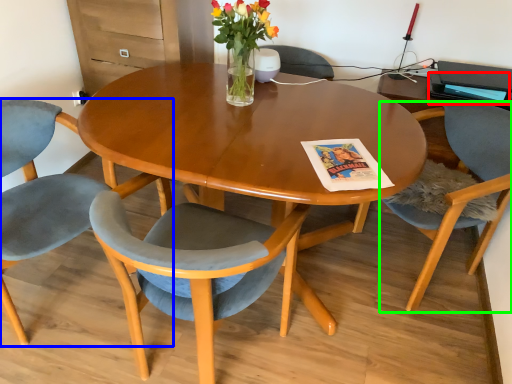
Question: Based on their relative distances, which object is nearer to magazine (highlighted by a red box)? Choose from chair (highlighted by a blue box) and chair (highlighted by a green box).

Choices:
 (A) chair
 (B) chair

Answer: (B)